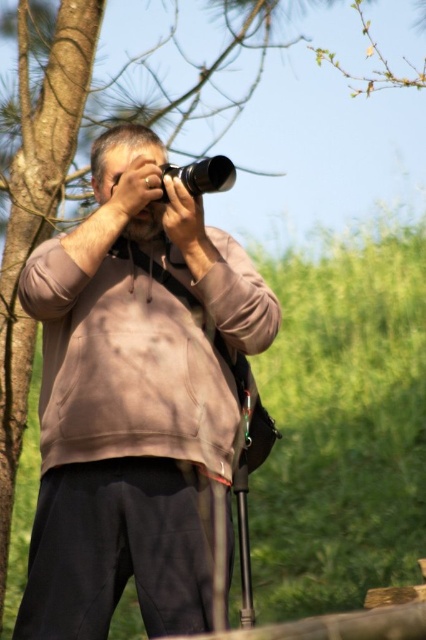
You are a photographer trying to capture a wide landscape shot. You have a camera and a brown cotton hoodie at center. How far apart are these two items?

The brown cotton hoodie at center and the camera are 3.54 meters apart.

You are a photographer trying to take a picture of the brown cotton hoodie at center. The metallic silver camera at center is in your hand. Can you aim the camera at the hoodie without moving your body?

The brown cotton hoodie at center is positioned under the metallic silver camera at center, so you can aim the camera downward to capture the hoodie without moving your body.

You are a photographer holding a metallic silver camera at center. You want to adjust the lens but need to reach into your brown cotton hoodie at center pocket. Can you do this without moving the camera?

The distance between the brown cotton hoodie at center and the metallic silver camera at center is 18.69 inches. Since the camera is held away from the body, you can likely reach into the hoodie pocket without moving the camera.